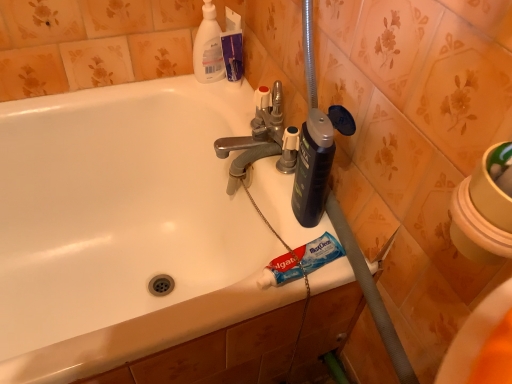
Question: In the image, is white plastic bottle at upper center positioned in front of or behind blue matte toothpaste at lower center?

Choices:
 (A) behind
 (B) front

Answer: (A)

Question: In terms of size, does white plastic bottle at upper center appear bigger or smaller than blue matte toothpaste at lower center?

Choices:
 (A) small
 (B) big

Answer: (B)

Question: Which object is the farthest from the blue matte toothpaste at lower center?

Choices:
 (A) white glossy bathtub at center
 (B) white plastic bottle at upper center
 (C) polished chrome faucet at center

Answer: (B)

Question: Which object is the farthest from the polished chrome faucet at center?

Choices:
 (A) white glossy bathtub at center
 (B) white plastic bottle at upper center
 (C) blue matte toothpaste at lower center

Answer: (A)